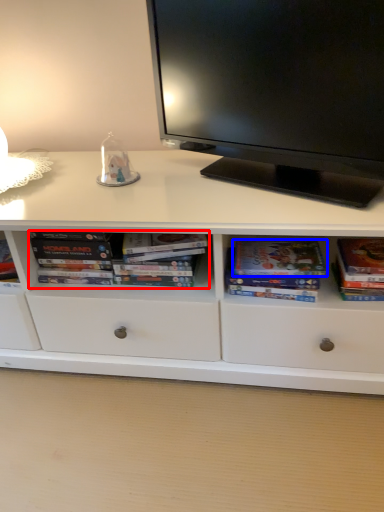
Question: Which object is further to the camera taking this photo, book (highlighted by a red box) or paperback book (highlighted by a blue box)?

Choices:
 (A) book
 (B) paperback book

Answer: (A)